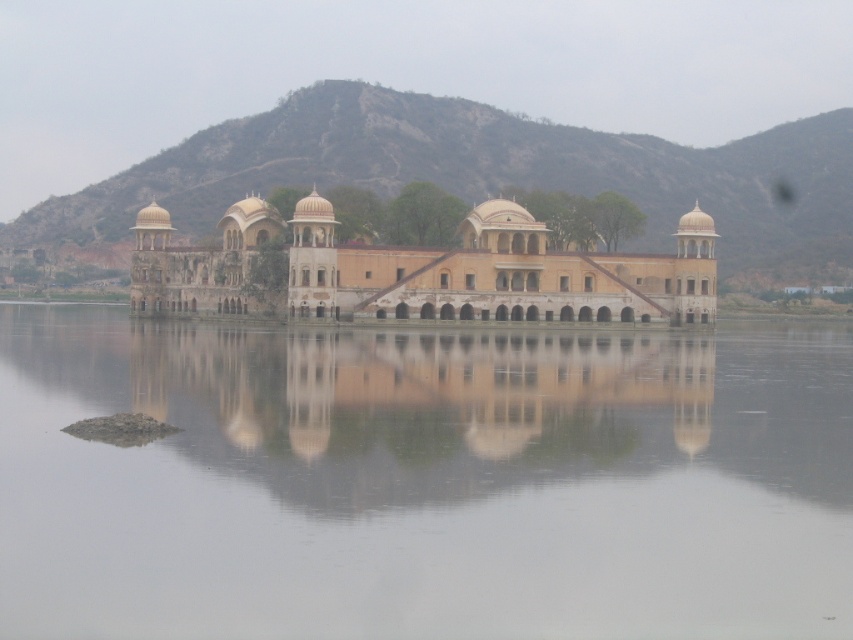
You are standing at the entrance of the historical building and want to take a photo of the transparent water at center. Based on its position, where should you aim your camera?

The transparent water at center is located at coordinates point (422, 481), so you should aim your camera towards that specific coordinate point to capture it in the frame.